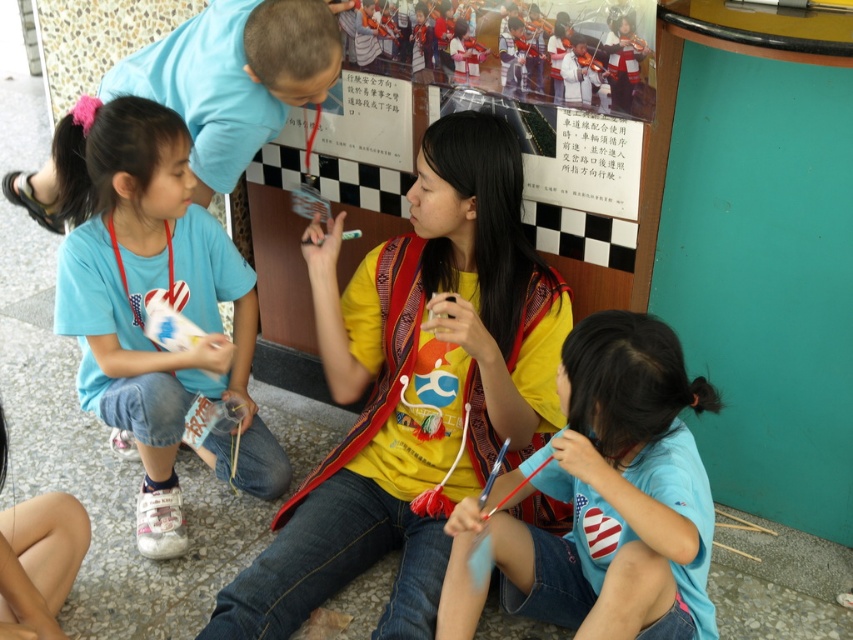
Between light blue cotton shirt at lower left and blue cotton shirt at lower center, which one appears on the right side from the viewer's perspective?

blue cotton shirt at lower center

From the picture: Can you confirm if light blue cotton shirt at lower left is thinner than blue cotton shirt at lower center?

In fact, light blue cotton shirt at lower left might be wider than blue cotton shirt at lower center.

You are a GUI agent. You are given a task and a screenshot of the screen. Output one action in this format:
    pyautogui.click(x=<x>, y=<y>)
    Task: Click on the light blue cotton shirt at lower left
    This screenshot has width=853, height=640.
    Given the screenshot: What is the action you would take?
    pyautogui.click(x=151, y=298)

Who is shorter, light blue cotton shirt at lower left or blue fabric shirt at upper left?

With less height is blue fabric shirt at upper left.

Is point (132, 240) farther from camera compared to point (254, 12)?

Yes, it is.

Is point (82, 376) positioned in front of point (271, 40)?

No, (82, 376) is further to viewer.

I want to click on light blue cotton shirt at lower left, so click(x=151, y=298).

Between yellow matte shirt at center and blue fabric shirt at upper left, which one has more height?

yellow matte shirt at center is taller.

Does point (496, 157) come closer to viewer compared to point (171, 61)?

Yes, point (496, 157) is closer to viewer.

Where is `yellow matte shirt at center`? The width and height of the screenshot is (853, 640). yellow matte shirt at center is located at coordinates (415, 387).